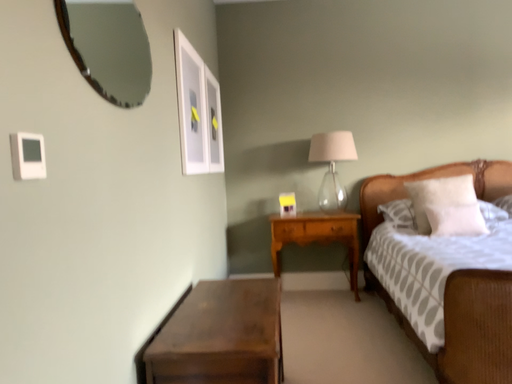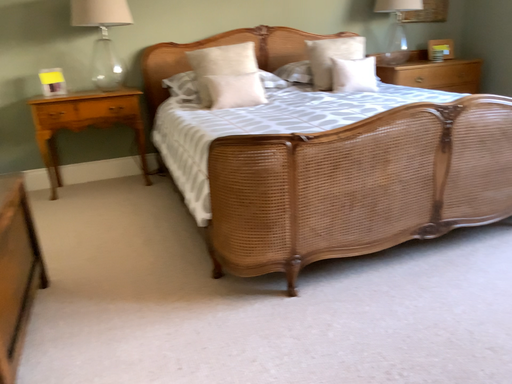
Question: Which way did the camera rotate in the video?

Choices:
 (A) rotated downward
 (B) rotated upward

Answer: (A)